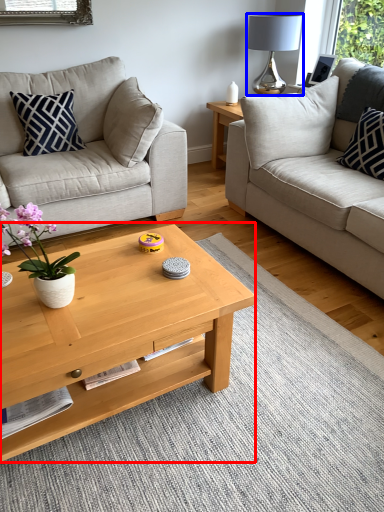
Question: Which object is closer to the camera taking this photo, coffee table (highlighted by a red box) or lamp (highlighted by a blue box)?

Choices:
 (A) coffee table
 (B) lamp

Answer: (A)